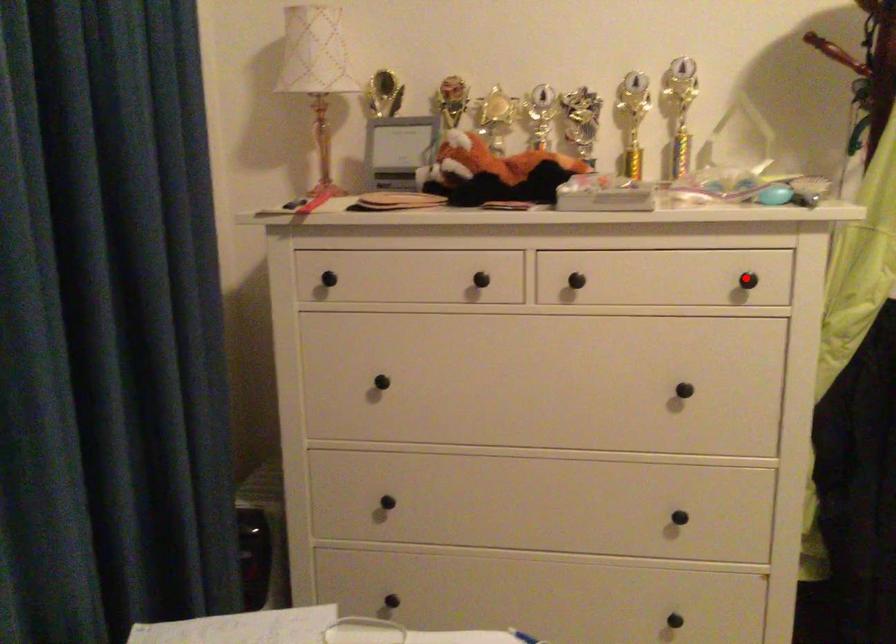
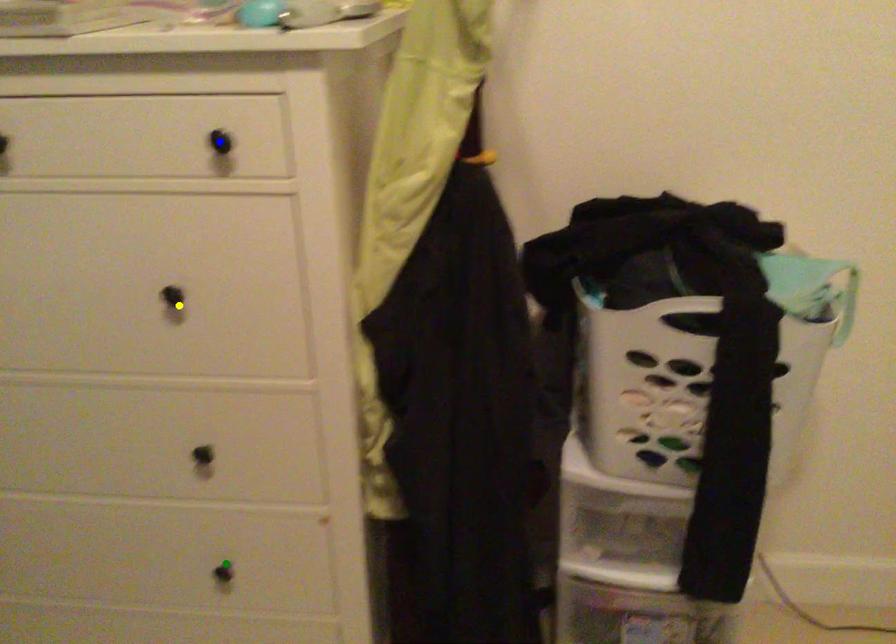
Question: I am providing you with two images of the same scene from different viewpoints. A red point is marked on the first image. You are given multiple points on the second image. Which point in image 2 represents the same 3d spot as the red point in image 1?

Choices:
 (A) green point
 (B) yellow point
 (C) blue point

Answer: (C)